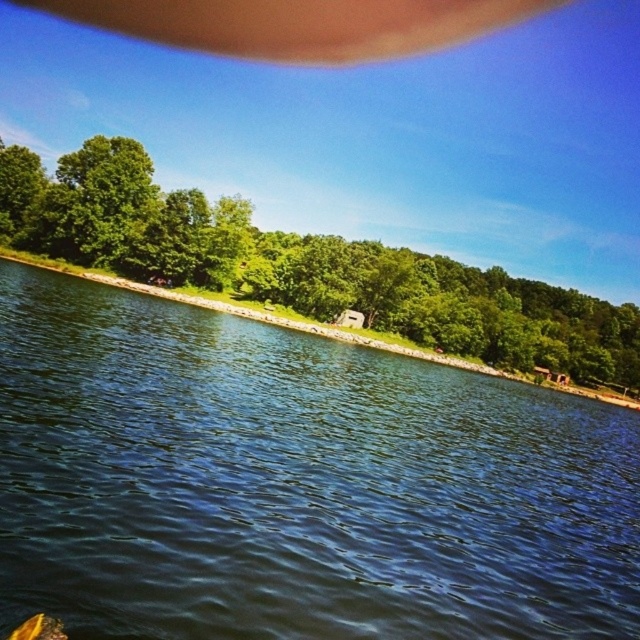
You are standing at the point with coordinates (292, 483) in the lakeside scene. What do you see directly beneath your feet?

At point (292, 483) lies blue water at center.

You are standing at the lakeside and looking at the two points marked in the image. Which point, point (179, 330) or point (531, 292), is closer to you?

Point (179, 330) is closer to you than point (531, 292).

From the picture: You are standing at the lakeside and want to cross to the other side. The blue water at center and the green leafy tree at center are in your path. Which one do you think you can walk around?

The blue water at center has a smaller width than the green leafy tree at center, so you can walk around the blue water at center more easily.